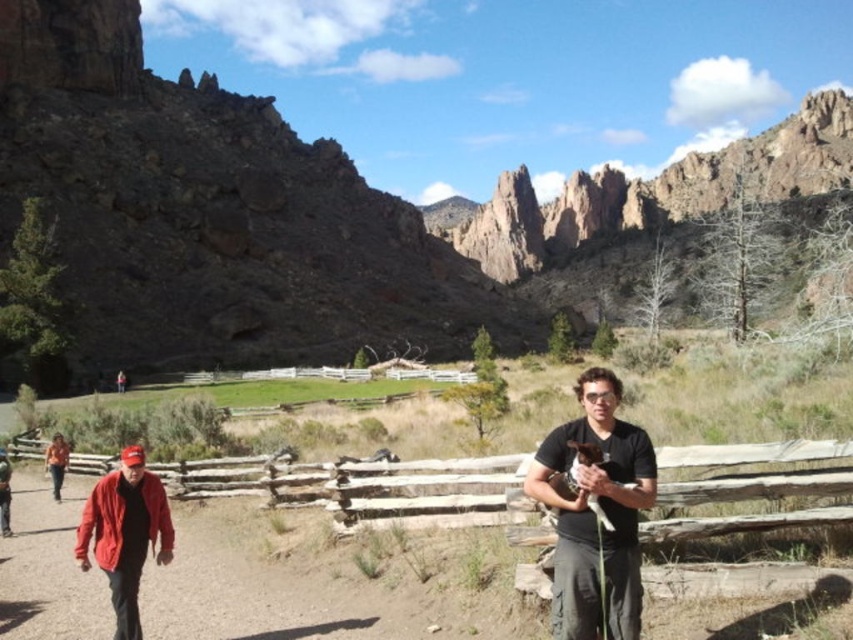
Question: Is black matte shirt at center positioned in front of white wooden fence at center?

Choices:
 (A) no
 (B) yes

Answer: (B)

Question: Among these objects, which one is farthest from the camera?

Choices:
 (A) matte red jacket at left
 (B) black matte shirt at center

Answer: (A)

Question: Observing the image, what is the correct spatial positioning of wooden at center in reference to orange shirt at lower left?

Choices:
 (A) right
 (B) left

Answer: (A)

Question: Which of the following is the farthest from the observer?

Choices:
 (A) (643, 476)
 (B) (20, 4)

Answer: (B)

Question: Can you confirm if black matte shirt at center is positioned to the left of white wooden fence at center?

Choices:
 (A) yes
 (B) no

Answer: (B)

Question: Which of the following is the closest to the observer?

Choices:
 (A) (129, 593)
 (B) (225, 477)
 (C) (558, 508)

Answer: (C)